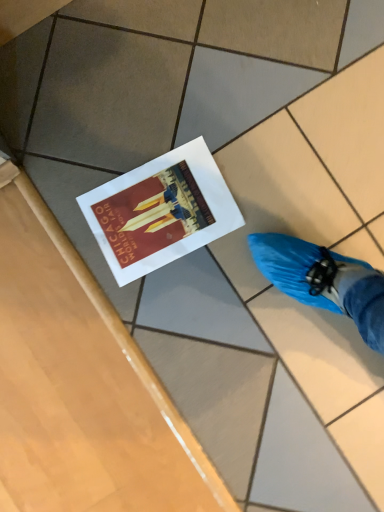
Question: Should I look upward or downward to see matte paper postcard at center?

Choices:
 (A) up
 (B) down

Answer: (A)